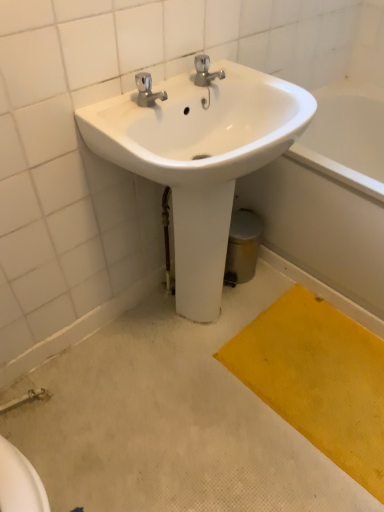
Where is `free region under white glossy sink at upper center (from a real-world perspective)`? The height and width of the screenshot is (512, 384). free region under white glossy sink at upper center (from a real-world perspective) is located at coordinates (197, 326).